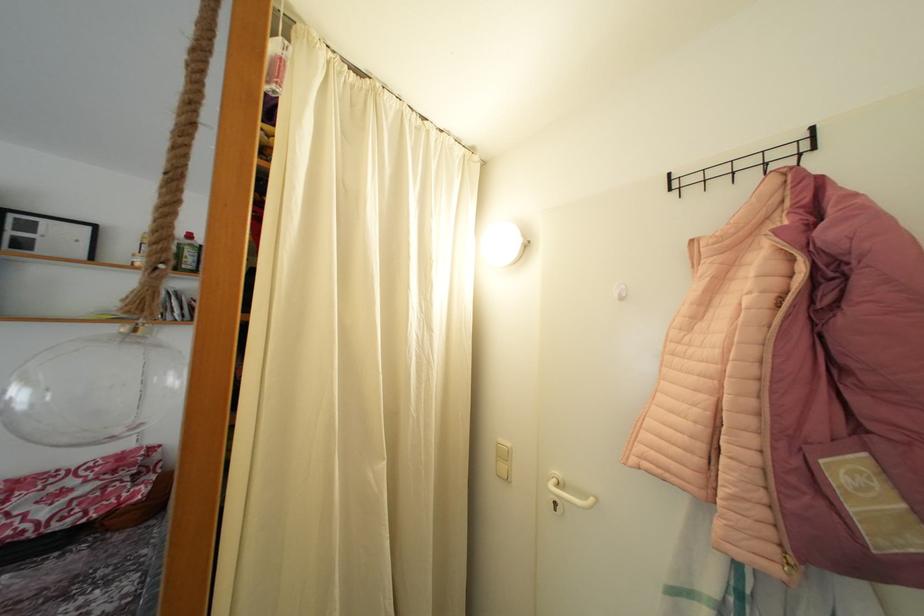
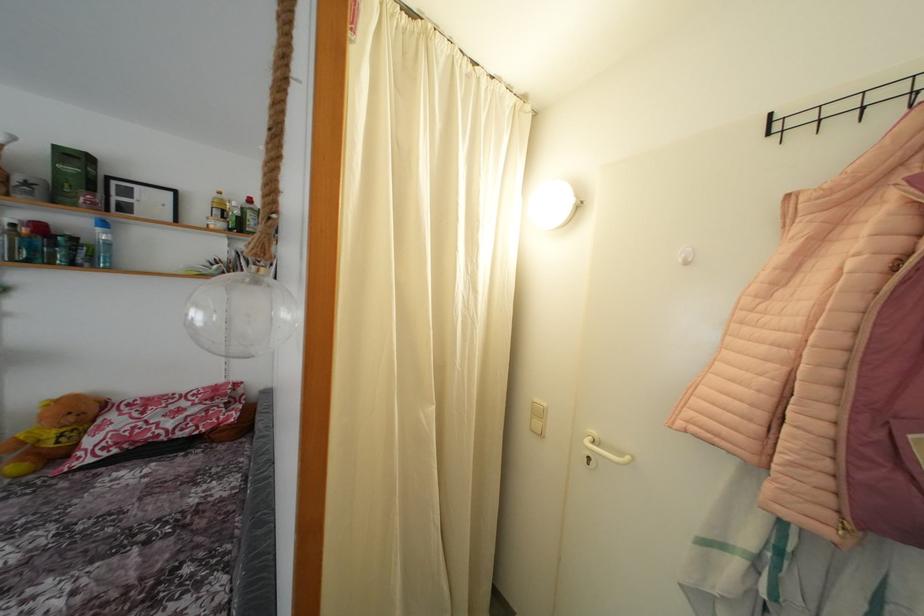
Question: I am providing you with two images of the same scene from different viewpoints. After the viewpoint changes to image2, which objects are now occluded?

Choices:
 (A) white wall hook
 (B) clear glass orb
 (C) black wall hook
 (D) none of these

Answer: (D)